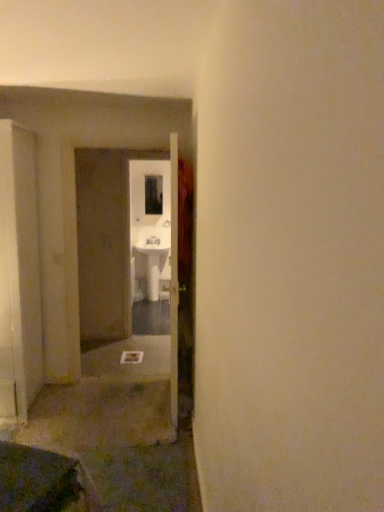
Question: From a real-world perspective, does white glossy sink at center stand above transparent glass window at center?

Choices:
 (A) yes
 (B) no

Answer: (B)

Question: From the image's perspective, does white glossy sink at center appear lower than transparent glass window at center?

Choices:
 (A) yes
 (B) no

Answer: (A)

Question: Does white glossy sink at center come in front of transparent glass window at center?

Choices:
 (A) no
 (B) yes

Answer: (B)

Question: Is white glossy sink at center shorter than transparent glass window at center?

Choices:
 (A) no
 (B) yes

Answer: (A)

Question: Would you say transparent glass window at center is part of white glossy sink at center's contents?

Choices:
 (A) yes
 (B) no

Answer: (B)

Question: Is white glossy sink at center placed right next to transparent glass window at center?

Choices:
 (A) yes
 (B) no

Answer: (B)

Question: Is transparent glass window at center far away from white glossy sink at center?

Choices:
 (A) no
 (B) yes

Answer: (A)

Question: Is the surface of transparent glass window at center in direct contact with white glossy sink at center?

Choices:
 (A) yes
 (B) no

Answer: (B)

Question: Is transparent glass window at center outside of white glossy sink at center?

Choices:
 (A) no
 (B) yes

Answer: (B)

Question: Considering the relative sizes of transparent glass window at center and white glossy sink at center in the image provided, is transparent glass window at center thinner than white glossy sink at center?

Choices:
 (A) no
 (B) yes

Answer: (B)

Question: From a real-world perspective, is transparent glass window at center positioned under white glossy sink at center based on gravity?

Choices:
 (A) yes
 (B) no

Answer: (B)

Question: From the image's perspective, is transparent glass window at center under white glossy sink at center?

Choices:
 (A) no
 (B) yes

Answer: (A)

Question: From a real-world perspective, is transparent glass window at center physically located above or below white glossy sink at center?

Choices:
 (A) above
 (B) below

Answer: (A)